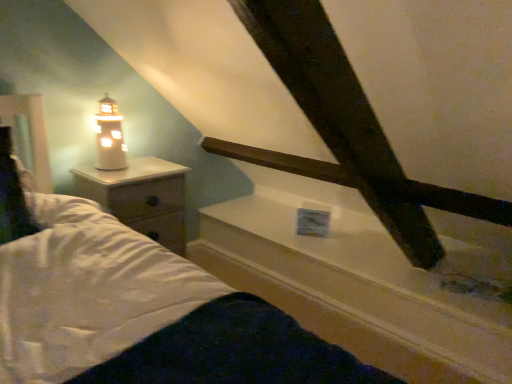
Describe the element at coordinates (109, 136) in the screenshot. I see `white ceramic lighthouse at left` at that location.

Locate an element on the screen. This screenshot has height=384, width=512. white wood nightstand at left is located at coordinates (141, 197).

From the image's perspective, does white wood nightstand at left appear lower than white glossy window sill at upper center?

No.

Which object is further away from the camera, white wood nightstand at left or white glossy window sill at upper center?

white wood nightstand at left.

From a real-world perspective, is white wood nightstand at left under white glossy window sill at upper center?

Actually, white wood nightstand at left is physically above white glossy window sill at upper center in the real world.

Can you confirm if white wood nightstand at left is smaller than white glossy window sill at upper center?

Yes, white wood nightstand at left is smaller than white glossy window sill at upper center.

Is white glossy window sill at upper center not inside white ceramic lighthouse at left?

white glossy window sill at upper center is positioned outside white ceramic lighthouse at left.

The height and width of the screenshot is (384, 512). I want to click on lamp located behind the white glossy window sill at upper center, so click(x=109, y=136).

In the image, is white glossy window sill at upper center positioned in front of or behind white ceramic lighthouse at left?

white glossy window sill at upper center is positioned closer to the viewer than white ceramic lighthouse at left.

Is white glossy window sill at upper center beside white ceramic lighthouse at left?

No, white glossy window sill at upper center is not beside white ceramic lighthouse at left.

From the image's perspective, relative to white wood nightstand at left, is white glossy window sill at upper center above or below?

white glossy window sill at upper center is situated lower than white wood nightstand at left in the image.

Between white glossy window sill at upper center and white wood nightstand at left, which one has smaller size?

white wood nightstand at left.

Does white glossy window sill at upper center have a lesser height compared to white wood nightstand at left?

Correct, white glossy window sill at upper center is not as tall as white wood nightstand at left.

Do you think white glossy window sill at upper center is within white wood nightstand at left, or outside of it?

white glossy window sill at upper center is not enclosed by white wood nightstand at left.

Looking at this image, is white wood nightstand at left at the left side of white ceramic lighthouse at left?

In fact, white wood nightstand at left is to the right of white ceramic lighthouse at left.

Who is more distant, white wood nightstand at left or white ceramic lighthouse at left?

white ceramic lighthouse at left is behind.

From the image's perspective, which one is positioned higher, white wood nightstand at left or white ceramic lighthouse at left?

white ceramic lighthouse at left is shown above in the image.

From their relative heights in the image, would you say white wood nightstand at left is taller or shorter than white ceramic lighthouse at left?

In the image, white wood nightstand at left appears to be taller than white ceramic lighthouse at left.

Between white ceramic lighthouse at left and white glossy window sill at upper center, which one has less height?

white glossy window sill at upper center.

You are a GUI agent. You are given a task and a screenshot of the screen. Output one action in this format:
    pyautogui.click(x=<x>, y=<y>)
    Task: Click on the lamp located behind the white glossy window sill at upper center
    This screenshot has height=384, width=512.
    Given the screenshot: What is the action you would take?
    [109, 136]

Is white ceramic lighthouse at left oriented away from white glossy window sill at upper center?

white ceramic lighthouse at left does not have its back to white glossy window sill at upper center.

Can you confirm if white ceramic lighthouse at left is thinner than white wood nightstand at left?

Yes, white ceramic lighthouse at left is thinner than white wood nightstand at left.

Could you tell me if white ceramic lighthouse at left is facing white wood nightstand at left?

No, white ceramic lighthouse at left does not turn towards white wood nightstand at left.

Between white ceramic lighthouse at left and white wood nightstand at left, which one has more height?

white wood nightstand at left.

The height and width of the screenshot is (384, 512). Identify the location of window sill in front of the white wood nightstand at left. (356, 292).

At what (x,y) coordinates should I click in order to perform the action: click on lamp that is above the white glossy window sill at upper center (from a real-world perspective). Please return your answer as a coordinate pair (x, y). Looking at the image, I should click on (109, 136).

From the image, which object appears to be farther from white glossy window sill at upper center, white ceramic lighthouse at left or white wood nightstand at left?

white ceramic lighthouse at left is positioned further to the anchor white glossy window sill at upper center.

In the scene shown: Based on their spatial positions, is white glossy window sill at upper center or white wood nightstand at left further from white ceramic lighthouse at left?

Based on the image, white glossy window sill at upper center appears to be further to white ceramic lighthouse at left.

From the image, which object appears to be farther from white ceramic lighthouse at left, white wood nightstand at left or white glossy window sill at upper center?

white glossy window sill at upper center is further to white ceramic lighthouse at left.

From the image, which object appears to be farther from white wood nightstand at left, white ceramic lighthouse at left or white glossy window sill at upper center?

Among the two, white glossy window sill at upper center is located further to white wood nightstand at left.

Considering their positions, is white wood nightstand at left positioned closer to white glossy window sill at upper center than white ceramic lighthouse at left?

Based on the image, white wood nightstand at left appears to be nearer to white glossy window sill at upper center.

Estimate the real-world distances between objects in this image. Which object is closer to white wood nightstand at left, white glossy window sill at upper center or white ceramic lighthouse at left?

white ceramic lighthouse at left is closer to white wood nightstand at left.

Identify the location of nightstand between white ceramic lighthouse at left and white glossy window sill at upper center from left to right. (141, 197).